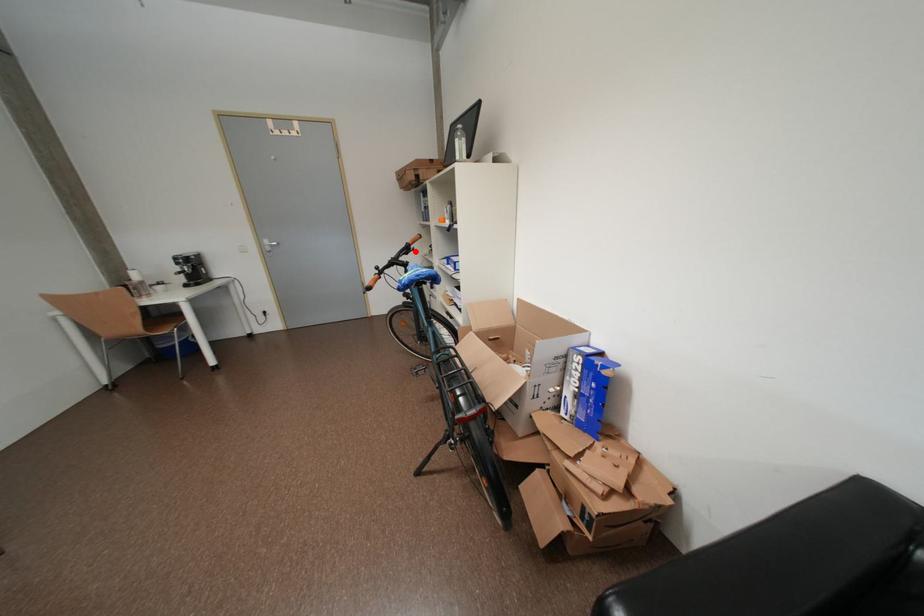
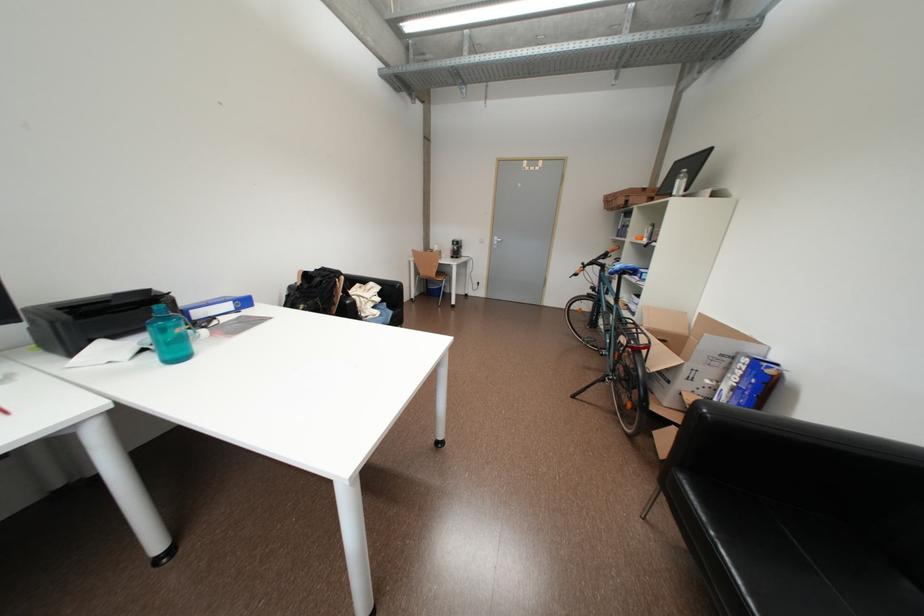
Question: I am providing you with two images of the same scene from different viewpoints. A red point is shown in image1. For the corresponding object point in image2, is it positioned nearer or farther from the camera?

Choices:
 (A) Nearer
 (B) Farther

Answer: (B)